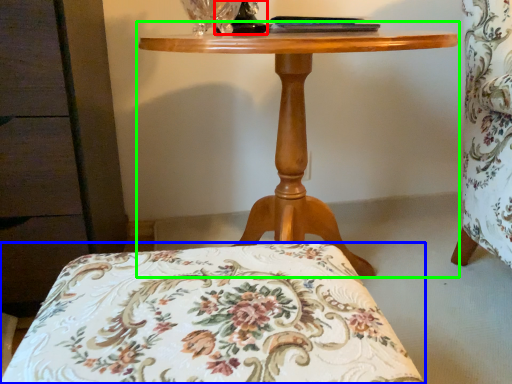
Question: Based on their relative distances, which object is nearer to table lamp (highlighted by a red box)? Choose from furniture (highlighted by a blue box) and table (highlighted by a green box).

Choices:
 (A) furniture
 (B) table

Answer: (B)